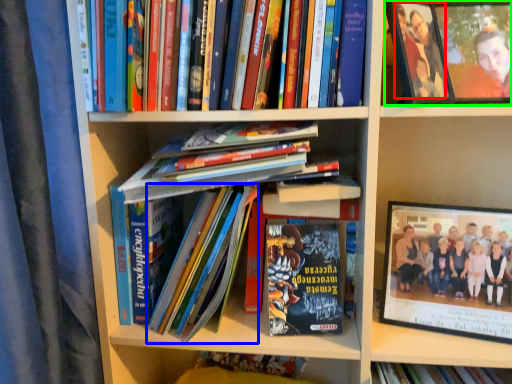
Question: Considering the real-world distances, which object is farthest from person (highlighted by a red box)? book (highlighted by a blue box) or picture frame (highlighted by a green box)?

Choices:
 (A) book
 (B) picture frame

Answer: (A)